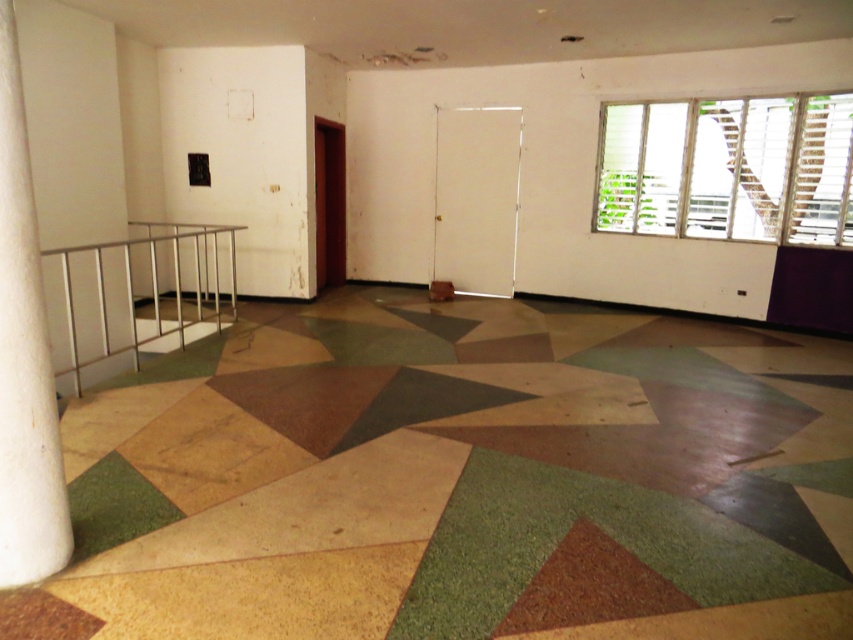
Question: Can you confirm if white marble pillar at left is positioned to the right of silver metallic balustrade at left?

Choices:
 (A) yes
 (B) no

Answer: (A)

Question: Which object appears farthest from the camera in this image?

Choices:
 (A) silver metallic balustrade at left
 (B) white marble pillar at left

Answer: (A)

Question: Is the position of white marble pillar at left more distant than that of silver metallic balustrade at left?

Choices:
 (A) yes
 (B) no

Answer: (B)

Question: Does white marble pillar at left have a greater width compared to silver metallic balustrade at left?

Choices:
 (A) yes
 (B) no

Answer: (B)

Question: Which point is closer to the camera?

Choices:
 (A) (42, 484)
 (B) (218, 316)

Answer: (A)